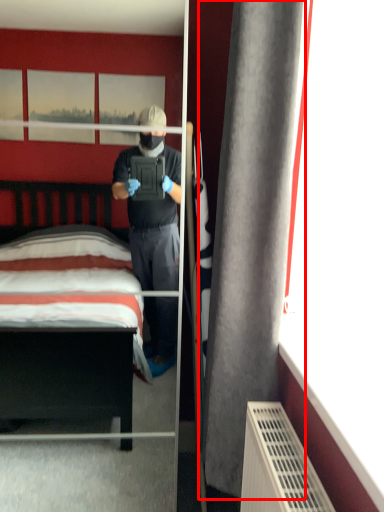
Question: From the image, what is the correct spatial relationship of curtain (annotated by the red box) in relation to mirror?

Choices:
 (A) right
 (B) left

Answer: (A)